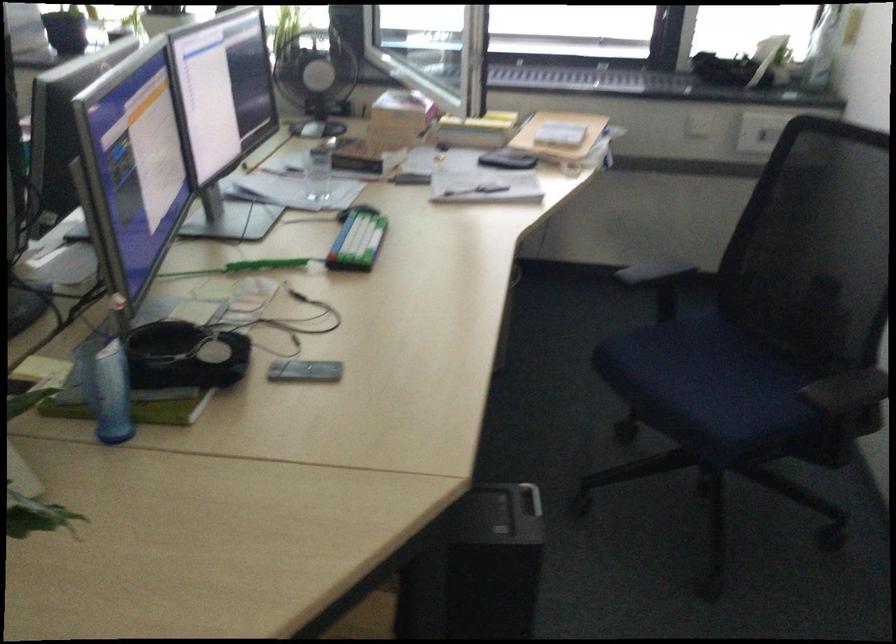
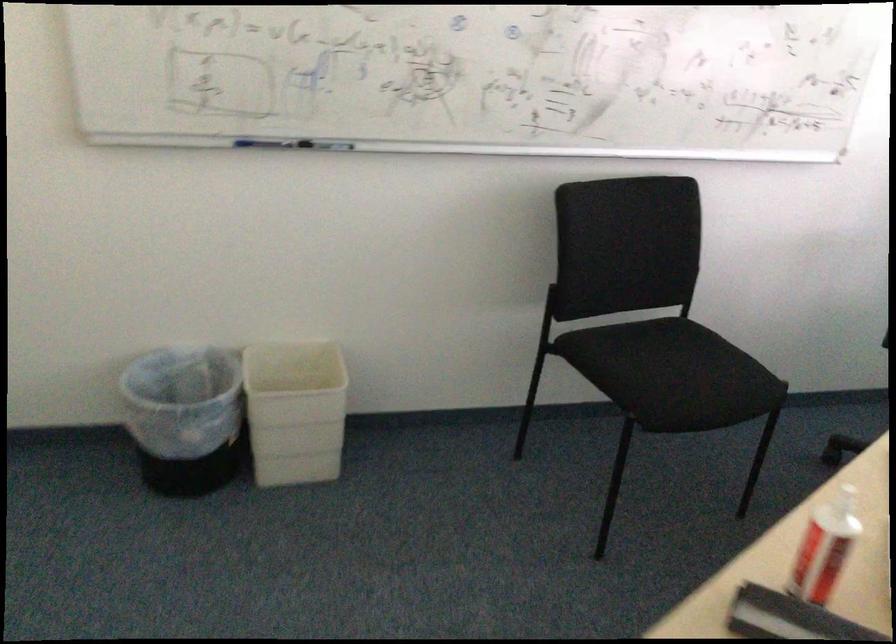
Based on the continuous images, in which direction is the camera rotating?

The rotation direction of the camera is left-down.